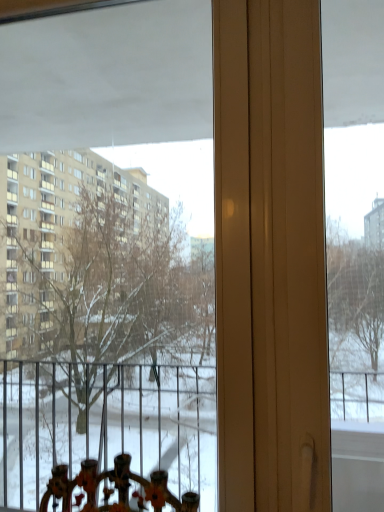
Question: From the image's perspective, is transparent glass window at center located beneath transparent plastic screen at center?

Choices:
 (A) no
 (B) yes

Answer: (A)

Question: Is transparent glass window at center turned away from transparent plastic screen at center?

Choices:
 (A) no
 (B) yes

Answer: (A)

Question: Is transparent glass window at center at the left side of transparent plastic screen at center?

Choices:
 (A) no
 (B) yes

Answer: (B)

Question: Is transparent glass window at center to the right of transparent plastic screen at center from the viewer's perspective?

Choices:
 (A) no
 (B) yes

Answer: (A)

Question: Does transparent glass window at center have a greater height compared to transparent plastic screen at center?

Choices:
 (A) no
 (B) yes

Answer: (B)

Question: Considering the relative sizes of transparent glass window at center and transparent plastic screen at center in the image provided, is transparent glass window at center shorter than transparent plastic screen at center?

Choices:
 (A) no
 (B) yes

Answer: (A)

Question: Does transparent plastic screen at center come in front of transparent glass window at center?

Choices:
 (A) yes
 (B) no

Answer: (A)

Question: Can you see transparent plastic screen at center touching transparent glass window at center?

Choices:
 (A) no
 (B) yes

Answer: (A)

Question: Is transparent plastic screen at center far from transparent glass window at center?

Choices:
 (A) yes
 (B) no

Answer: (A)

Question: From the image's perspective, is transparent plastic screen at center on transparent glass window at center?

Choices:
 (A) no
 (B) yes

Answer: (A)

Question: Does transparent plastic screen at center have a smaller size compared to transparent glass window at center?

Choices:
 (A) no
 (B) yes

Answer: (B)

Question: From a real-world perspective, is transparent plastic screen at center positioned under transparent glass window at center based on gravity?

Choices:
 (A) no
 (B) yes

Answer: (B)

Question: Is transparent plastic screen at center wider or thinner than transparent glass window at center?

Choices:
 (A) wide
 (B) thin

Answer: (A)